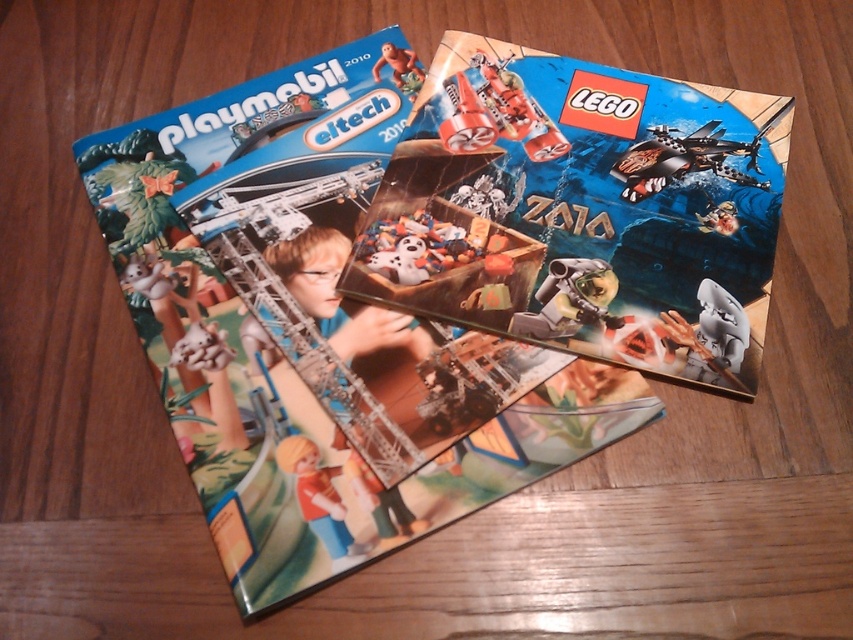
Question: Is matte plastic toy at center wider than matte plastic monkey at upper center?

Choices:
 (A) yes
 (B) no

Answer: (A)

Question: Which point is closer to the camera?

Choices:
 (A) (694, 180)
 (B) (401, 260)
 (C) (642, 168)
 (D) (341, 520)

Answer: (D)

Question: Does white plastic shark fin at center have a lesser width compared to matte plastic toy at center?

Choices:
 (A) yes
 (B) no

Answer: (A)

Question: Which point is farther to the camera?

Choices:
 (A) (416, 88)
 (B) (334, 499)
 (C) (384, 257)
 (D) (560, 314)

Answer: (A)

Question: Does matte plastic lego catalog at center have a greater width compared to plastic/smooth robot at center?

Choices:
 (A) no
 (B) yes

Answer: (B)

Question: Which point is farther from the camera taking this photo?

Choices:
 (A) (741, 384)
 (B) (590, 316)

Answer: (B)